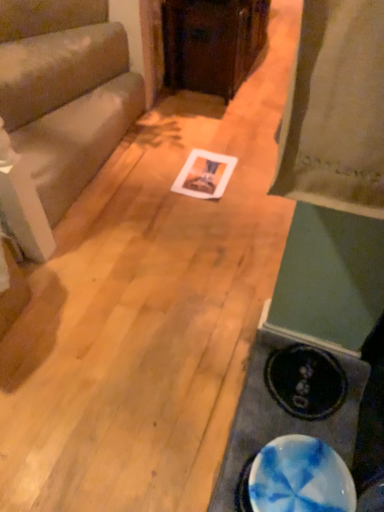
Identify the location of empty space that is in between blue marbled plate at lower right and wooden cabinet at center, positioned as the 2th furniture in bottom-to-top order. (231, 182).